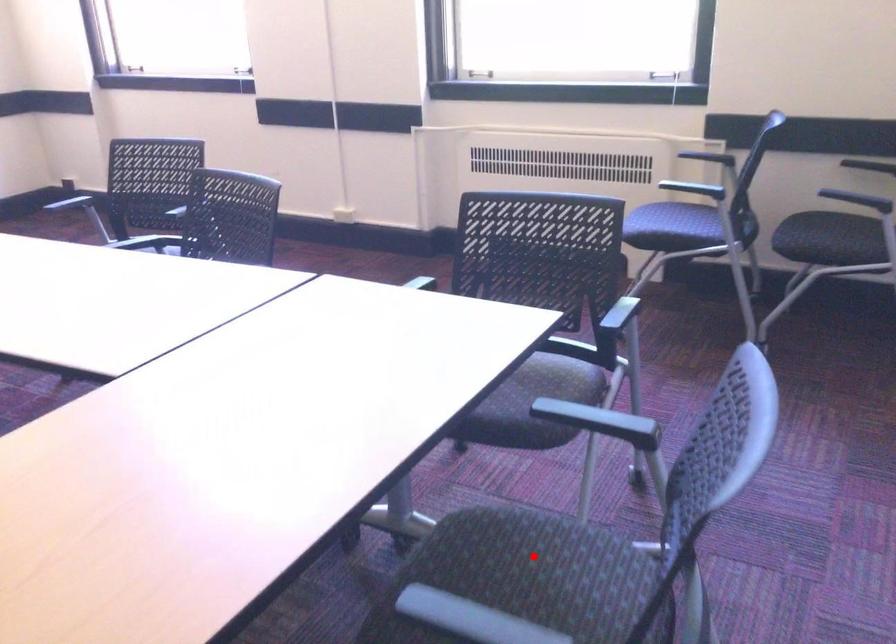
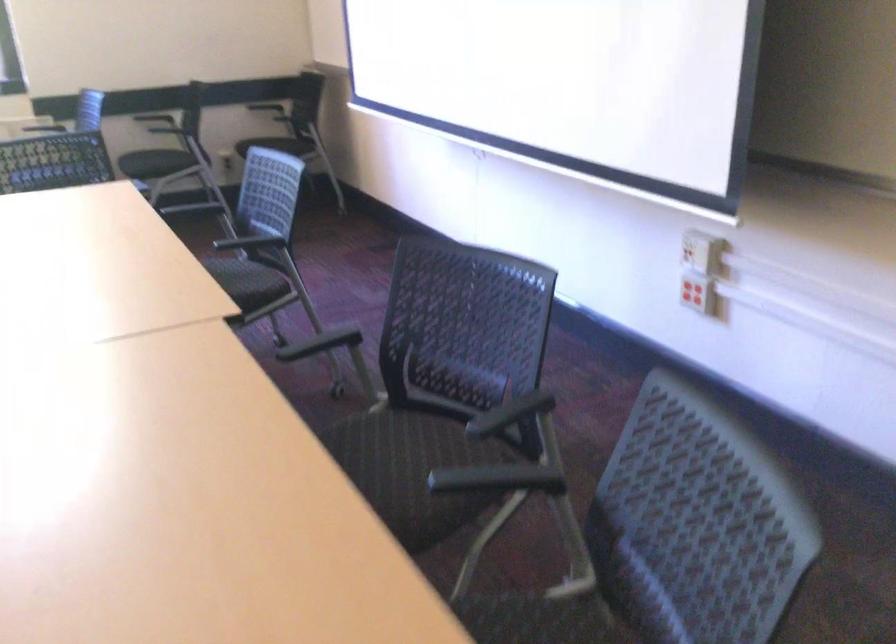
Question: I am providing you with two images of the same scene from different viewpoints. A red point is marked on the first image. Can you still see the location of the red point in image 2?

Choices:
 (A) Yes
 (B) No

Answer: (B)